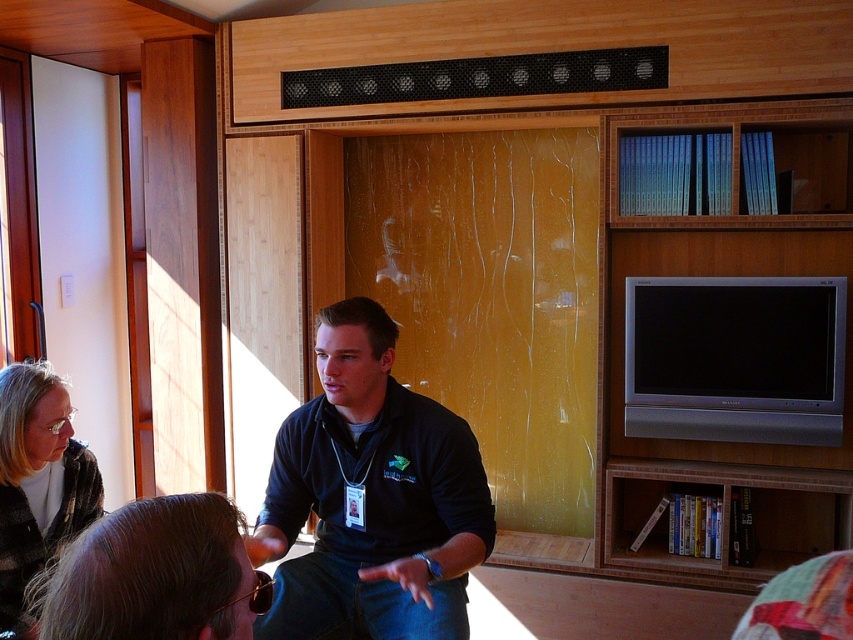
Is black matte shirt at center wider than brown hair at lower center?

Yes.

This screenshot has width=853, height=640. What do you see at coordinates (370, 499) in the screenshot? I see `black matte shirt at center` at bounding box center [370, 499].

Identify the location of black matte shirt at center. (370, 499).

Which is below, black matte shirt at center or matte black jacket at lower left?

matte black jacket at lower left is lower down.

Consider the image. Can you confirm if black matte shirt at center is positioned below matte black jacket at lower left?

No.

Identify the location of black matte shirt at center. The height and width of the screenshot is (640, 853). (370, 499).

Can you confirm if brown hair at lower center is taller than matte black jacket at lower left?

Incorrect, brown hair at lower center's height is not larger of matte black jacket at lower left's.

Based on the photo, does brown hair at lower center have a smaller size compared to matte black jacket at lower left?

Correct, brown hair at lower center occupies less space than matte black jacket at lower left.

Consider the image. Measure the distance between point (172, 547) and camera.

Point (172, 547) is 86.45 centimeters away from camera.

Identify the location of brown hair at lower center. (154, 576).